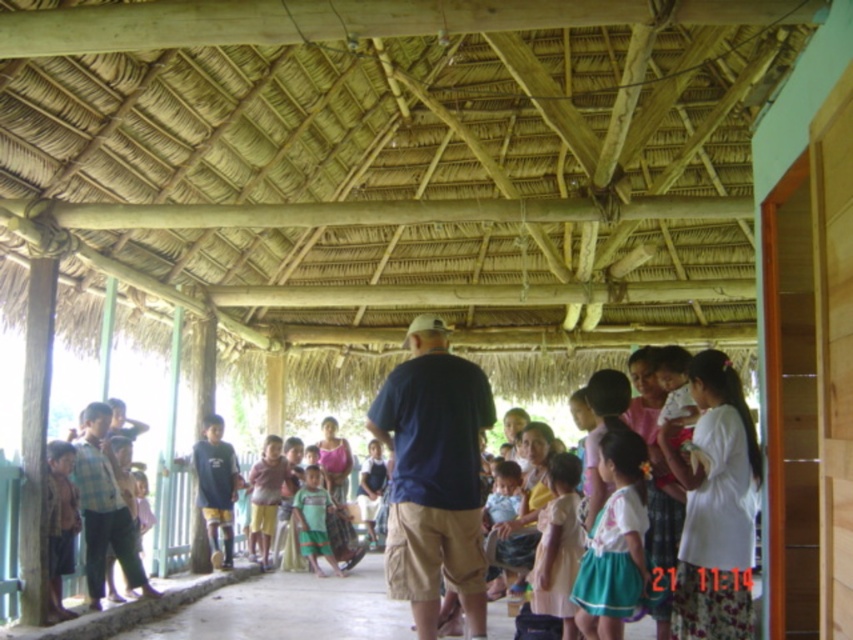
Question: Is white cotton dress at center to the right of brown woven skirt at lower left from the viewer's perspective?

Choices:
 (A) no
 (B) yes

Answer: (B)

Question: Which point appears farthest from the camera in this image?

Choices:
 (A) (643, 563)
 (B) (415, 320)
 (C) (570, 497)
 (D) (299, 528)

Answer: (D)

Question: Is light pink fabric dress at center thinner than brown woven skirt at lower left?

Choices:
 (A) yes
 (B) no

Answer: (B)

Question: Which object is the farthest from the light pink fabric dress at center?

Choices:
 (A) green cotton shirt at center
 (B) light brown wooden chair at center

Answer: (B)

Question: Estimate the real-world distances between objects in this image. Which object is farther from the green cotton shirt at center?

Choices:
 (A) white cotton dress at center
 (B) light brown wooden chair at center
 (C) dark blue shirt at center
 (D) brown woven skirt at lower left

Answer: (A)

Question: Does white cotton dress at center appear over light pink fabric dress at center?

Choices:
 (A) no
 (B) yes

Answer: (B)